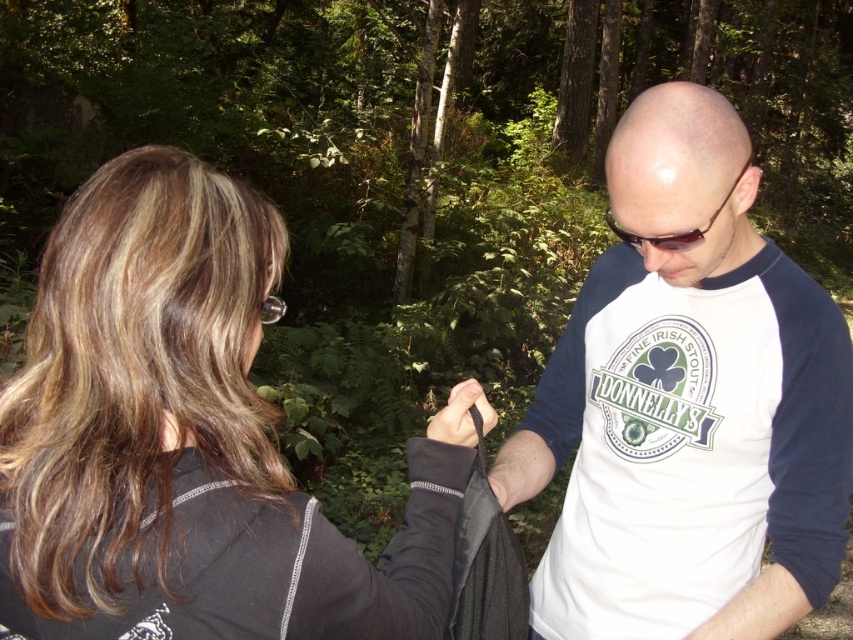
Is black fabric jacket at left below white fabric shirt at center?

Yes, black fabric jacket at left is below white fabric shirt at center.

Is point (265, 541) closer to viewer compared to point (738, 246)?

That is True.

Find the location of `black fabric jacket at left`. black fabric jacket at left is located at coordinates (189, 438).

Is point (305, 515) closer to viewer compared to point (724, 202)?

That is True.

Consider the image. Is black fabric jacket at left shorter than black plastic goggles at upper center?

No.

Where is `black fabric jacket at left`? black fabric jacket at left is located at coordinates (189, 438).

Is white fabric shirt at center smaller than black plastic goggles at upper center?

No.

Between white fabric shirt at center and black plastic goggles at upper center, which one is positioned higher?

black plastic goggles at upper center

This screenshot has width=853, height=640. Describe the element at coordinates (688, 404) in the screenshot. I see `white fabric shirt at center` at that location.

Locate an element on the screen. The height and width of the screenshot is (640, 853). white fabric shirt at center is located at coordinates (688, 404).